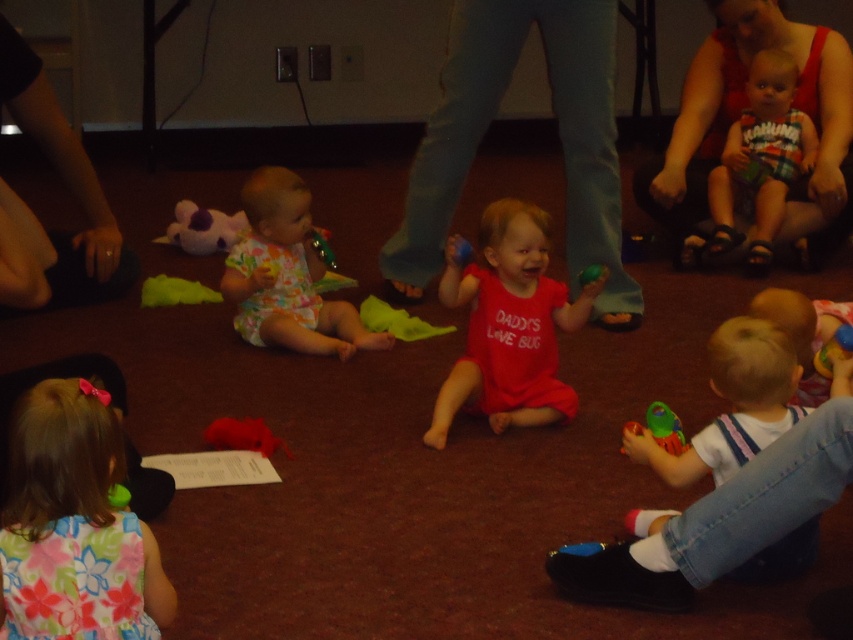
You are a parent trying to clean up the play area. You see the translucent plastic cup at lower right and the rubber yellow toy at lower right. Which object is closer to the ground?

The translucent plastic cup at lower right is closer to the ground because it is positioned below the rubber yellow toy at lower right.

Looking at this image, you are a photographer setting up for a group photo. You notice a translucent plastic cup at lower right and a rubber yellow toy at lower right. Which object should you adjust to avoid blocking the main subject if the cup is closer to you than the toy?

The translucent plastic cup at lower right is further to the viewer than the rubber yellow toy at lower right, so you should adjust the cup to avoid blocking the main subject since it is closer.

You are standing at the camera position and want to move towards the point at coordinates point (527, 236). Will you pass by the point at coordinates point (746, 364) first?

Yes, because point (527, 236) is behind point (746, 364) from the camera position, so you will pass point (746, 364) first when moving towards point (527, 236).